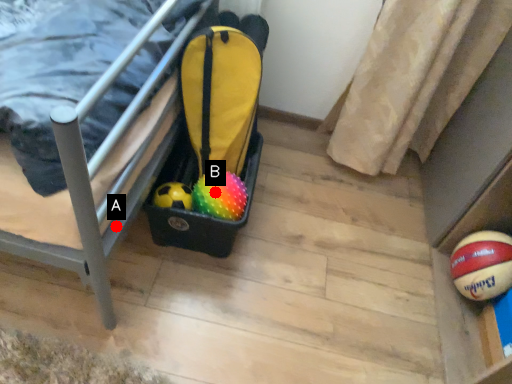
Question: Two points are circled on the image, labeled by A and B beside each circle. Among these points, which one is nearest to the camera?

Choices:
 (A) A is closer
 (B) B is closer

Answer: (A)